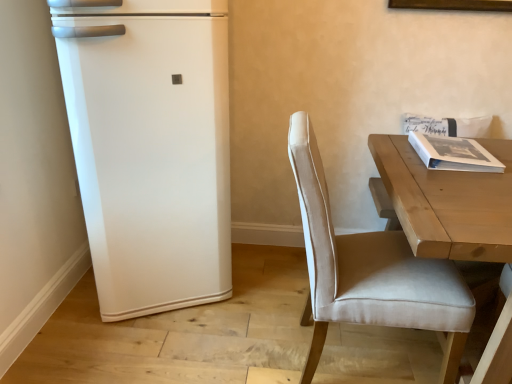
Question: Is white matte refrigerator at left directly adjacent to white matte book at upper right?

Choices:
 (A) yes
 (B) no

Answer: (B)

Question: From a real-world perspective, is white matte refrigerator at left on white matte book at upper right?

Choices:
 (A) yes
 (B) no

Answer: (B)

Question: Can you confirm if white matte refrigerator at left is shorter than white matte book at upper right?

Choices:
 (A) yes
 (B) no

Answer: (B)

Question: Is white matte refrigerator at left oriented away from white matte book at upper right?

Choices:
 (A) no
 (B) yes

Answer: (A)

Question: Is white matte refrigerator at left wider than white matte book at upper right?

Choices:
 (A) no
 (B) yes

Answer: (B)

Question: Is white matte refrigerator at left completely or partially outside of white matte book at upper right?

Choices:
 (A) no
 (B) yes

Answer: (B)

Question: Is white matte book at upper right completely or partially outside of light brown wooden table at right?

Choices:
 (A) yes
 (B) no

Answer: (A)

Question: Does white matte book at upper right have a greater width compared to light brown wooden table at right?

Choices:
 (A) no
 (B) yes

Answer: (A)

Question: From the image's perspective, does white matte book at upper right appear lower than light brown wooden table at right?

Choices:
 (A) no
 (B) yes

Answer: (A)

Question: Does white matte book at upper right have a smaller size compared to light brown wooden table at right?

Choices:
 (A) no
 (B) yes

Answer: (B)

Question: From the image's perspective, is white matte book at upper right above light brown wooden table at right?

Choices:
 (A) no
 (B) yes

Answer: (B)

Question: Considering the relative positions of white matte book at upper right and light brown wooden table at right in the image provided, is white matte book at upper right behind light brown wooden table at right?

Choices:
 (A) no
 (B) yes

Answer: (B)

Question: Does beige fabric chair at right have a smaller size compared to light brown wooden table at right?

Choices:
 (A) no
 (B) yes

Answer: (B)